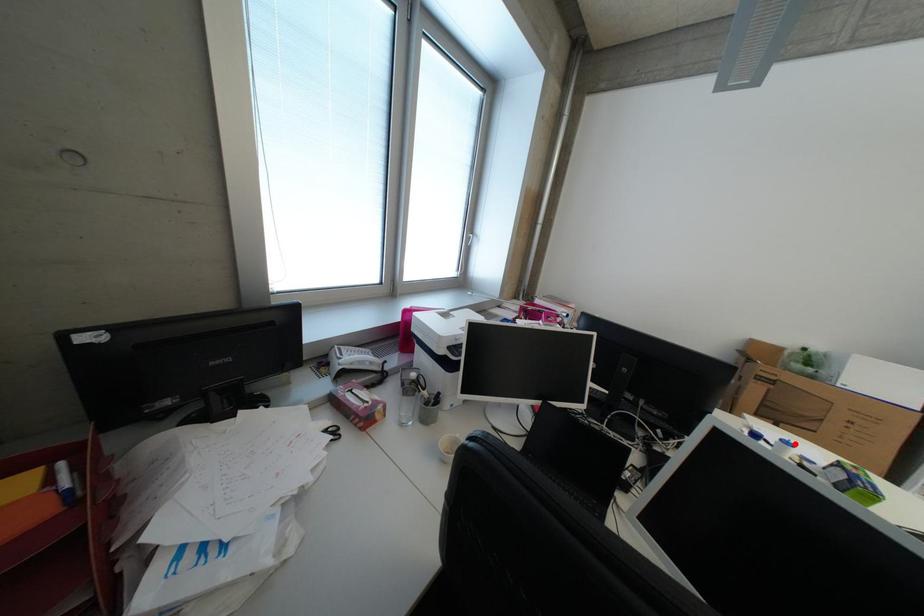
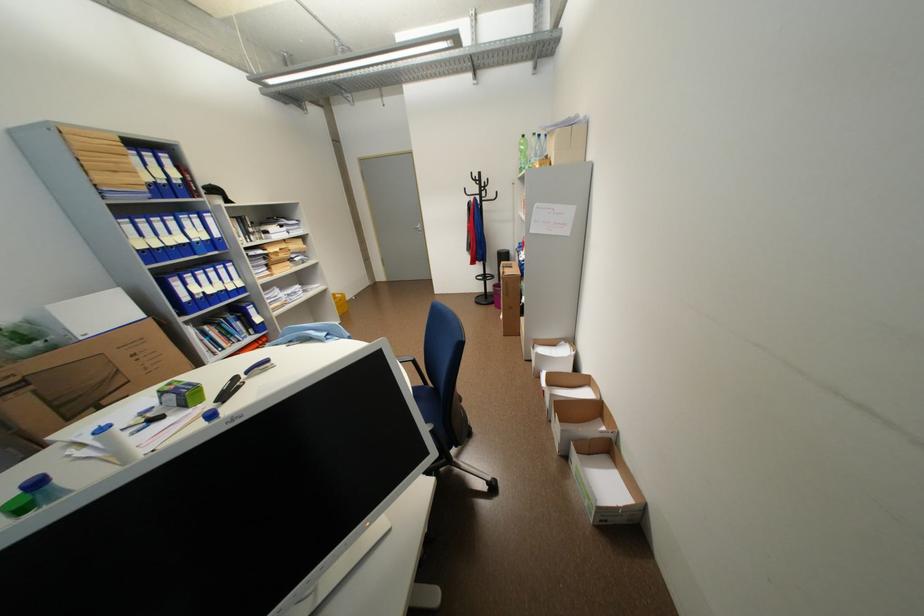
The point at the highlighted location is marked in the first image. Where is the corresponding point in the second image?

(111, 431)